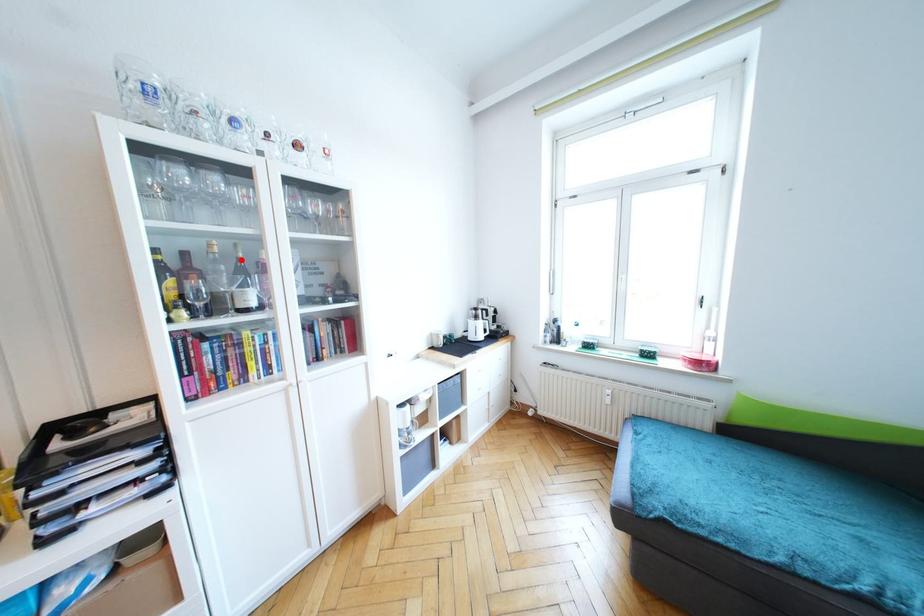
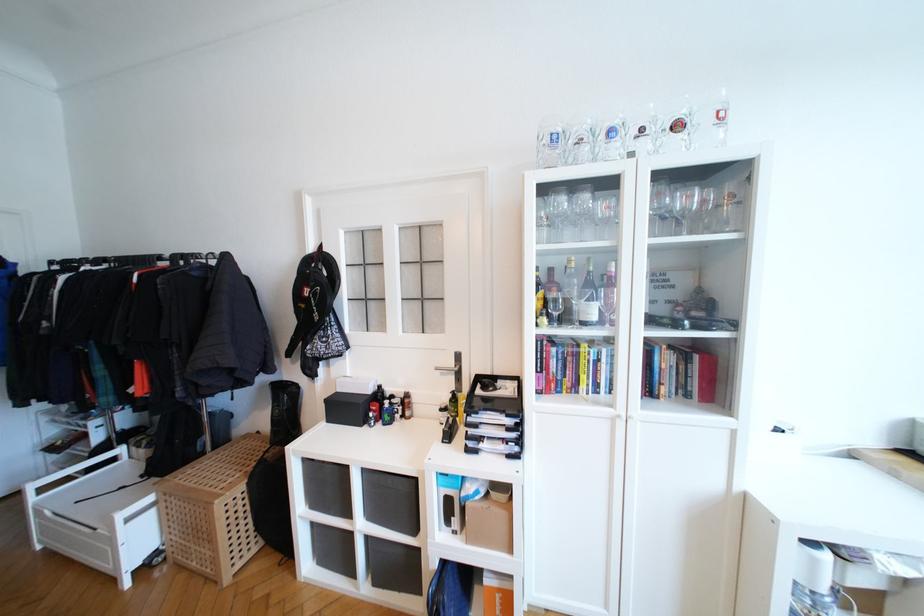
Where in the second image is the point corresponding to the highlighted location from the first image?

(591, 273)